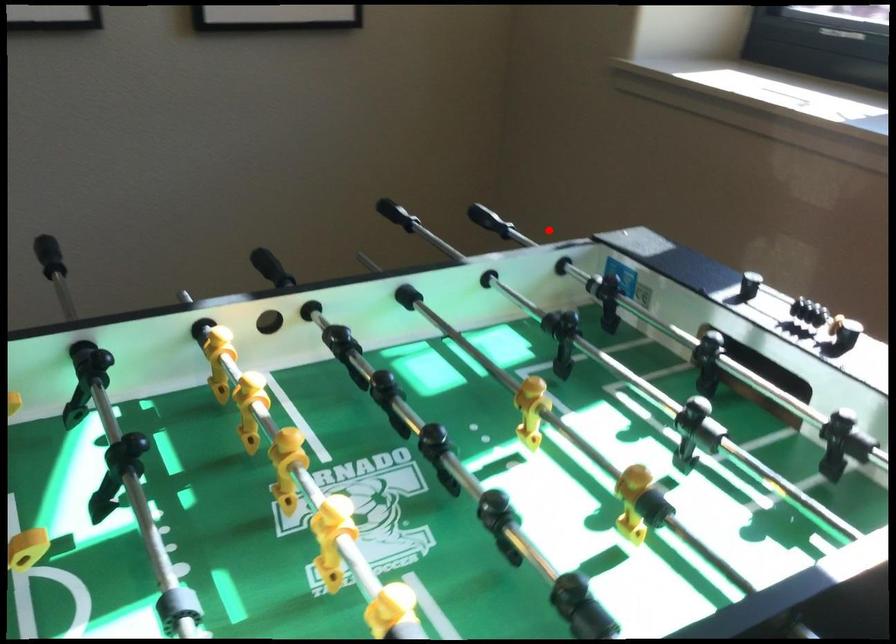
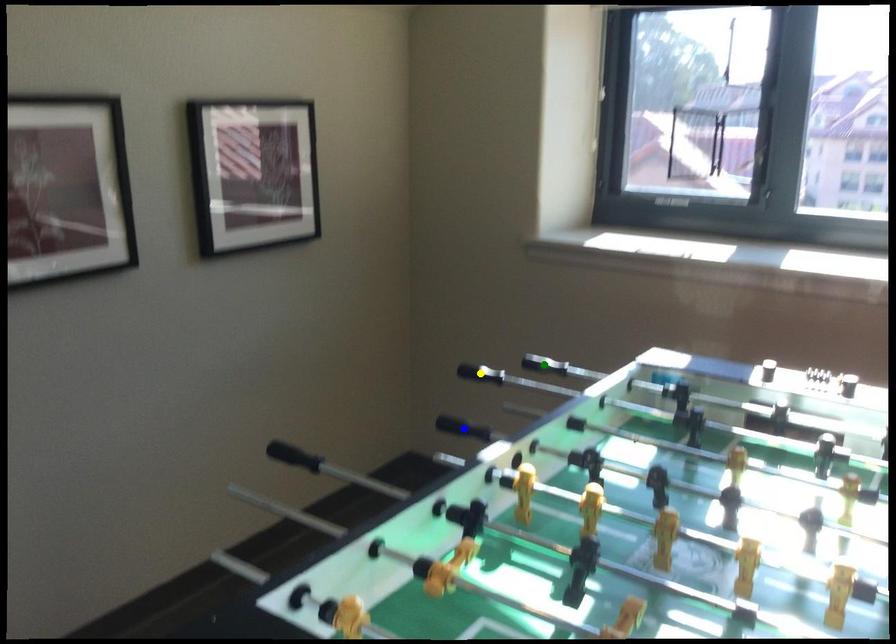
Question: I am providing you with two images of the same scene from different viewpoints. A red point is marked on the first image. You are given multiple points on the second image. Which spot in image 2 lines up with the point in image 1?

Choices:
 (A) yellow point
 (B) green point
 (C) blue point

Answer: (A)